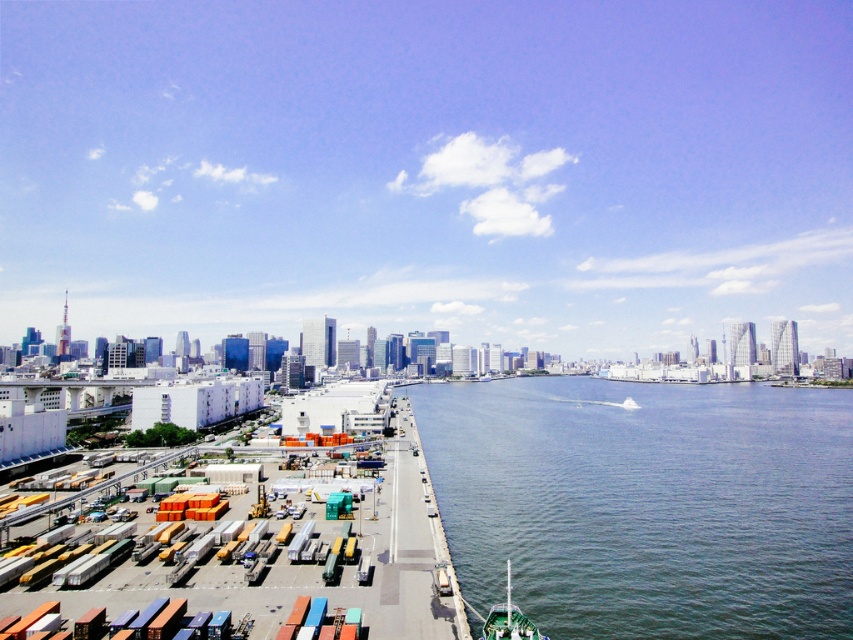
Question: Does clear water at center lie behind green matte boat at lower right?

Choices:
 (A) yes
 (B) no

Answer: (A)

Question: Which point is farther to the camera?

Choices:
 (A) (189, 612)
 (B) (492, 385)

Answer: (B)

Question: Which object is positioned farthest from the white matte dock at lower left?

Choices:
 (A) clear water at center
 (B) green matte boat at lower right

Answer: (A)

Question: Which object appears closest to the camera in this image?

Choices:
 (A) white matte dock at lower left
 (B) green matte boat at lower right
 (C) clear water at center

Answer: (A)

Question: Does clear water at center appear over green matte boat at lower right?

Choices:
 (A) no
 (B) yes

Answer: (A)

Question: Does white matte dock at lower left come in front of green matte boat at lower right?

Choices:
 (A) yes
 (B) no

Answer: (A)